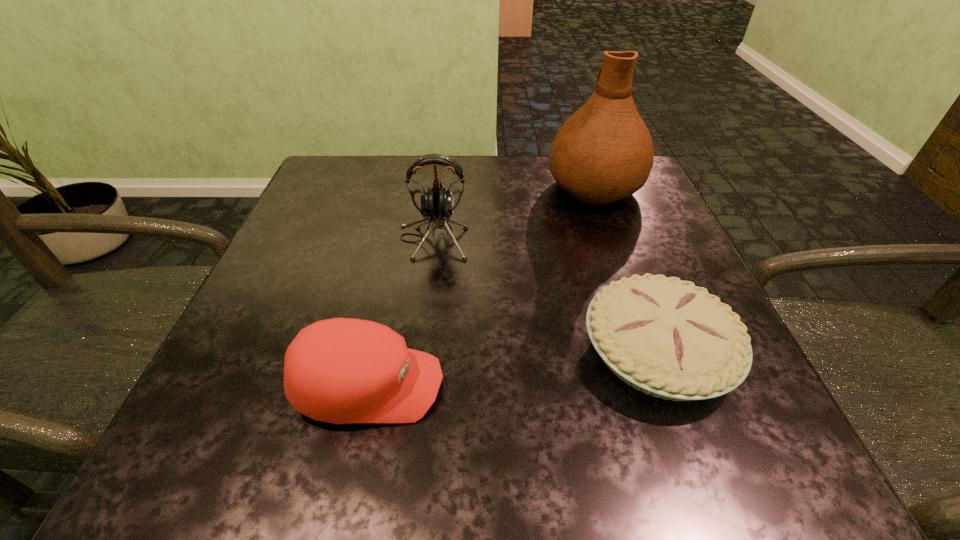
At what (x,y) coordinates should I click in order to perform the action: click on the tallest object. Please return your answer as a coordinate pair (x, y). Looking at the image, I should click on (603, 153).

Where is `pitcher`? This screenshot has width=960, height=540. pitcher is located at coordinates (603, 153).

Where is `the second farthest object`? the second farthest object is located at coordinates (436, 204).

Image resolution: width=960 pixels, height=540 pixels. Find the location of `earphone`. earphone is located at coordinates (436, 204).

Locate an element on the screen. cap is located at coordinates (342, 370).

I want to click on the shortest object, so click(x=668, y=338).

Find the location of a particular element. vacant space situated on the right of the second farthest object is located at coordinates (600, 239).

Where is `free space located on the front-facing side of the second shortest object`? This screenshot has height=540, width=960. free space located on the front-facing side of the second shortest object is located at coordinates (564, 386).

You are a GUI agent. You are given a task and a screenshot of the screen. Output one action in this format:
    pyautogui.click(x=<x>, y=<y>)
    Task: Click on the vacant space situated 0.210m on the back of the shortest object
    This screenshot has width=960, height=540.
    Given the screenshot: What is the action you would take?
    pyautogui.click(x=612, y=225)

What are the coordinates of `object located at the far edge` in the screenshot? It's located at (603, 153).